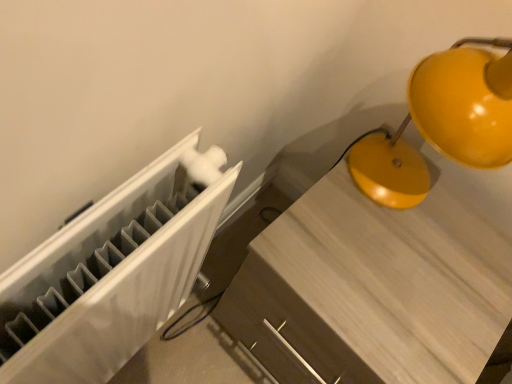
At what (x,y) coordinates should I click in order to perform the action: click on vacant area situated below matte yellow lamp at upper right (from a real-world perspective). Please return your answer as a coordinate pair (x, y). Looking at the image, I should click on (391, 177).